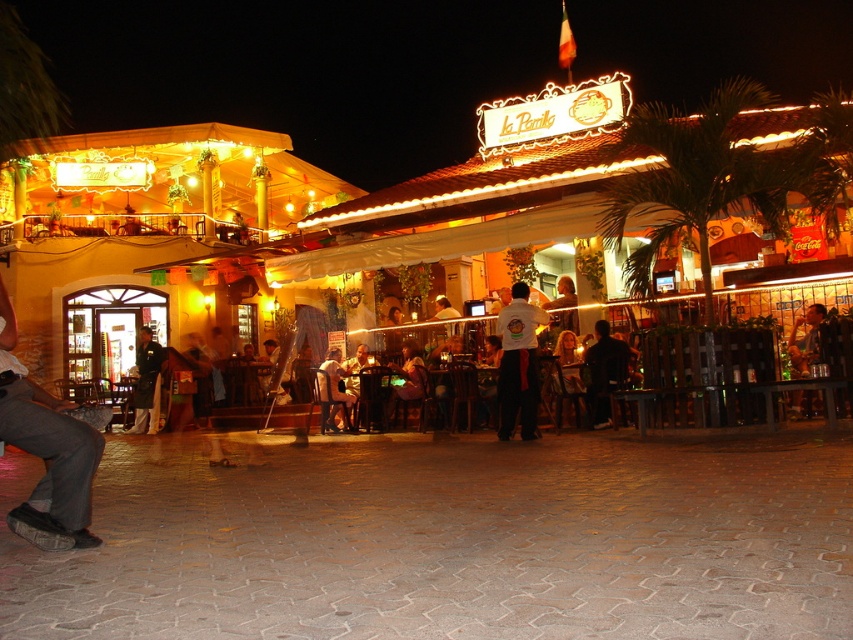
Question: Can you confirm if denim pants at lower left is positioned above dark brown leather jacket at center?

Choices:
 (A) yes
 (B) no

Answer: (B)

Question: Among these objects, which one is farthest from the camera?

Choices:
 (A) dark brown leather jacket at center
 (B) denim pants at lower left
 (C) dark green uniform at center

Answer: (C)

Question: Is white t-shirt at center wider than dark brown leather jacket at center?

Choices:
 (A) yes
 (B) no

Answer: (B)

Question: Estimate the real-world distances between objects in this image. Which object is closer to the dark brown leather jacket at center?

Choices:
 (A) dark green uniform at center
 (B) denim pants at lower left

Answer: (B)

Question: Which of the following is the farthest from the observer?

Choices:
 (A) white t-shirt at center
 (B) dark brown leather jacket at center

Answer: (A)

Question: Considering the relative positions of denim pants at lower left and dark green uniform at center in the image provided, where is denim pants at lower left located with respect to dark green uniform at center?

Choices:
 (A) left
 (B) right

Answer: (B)